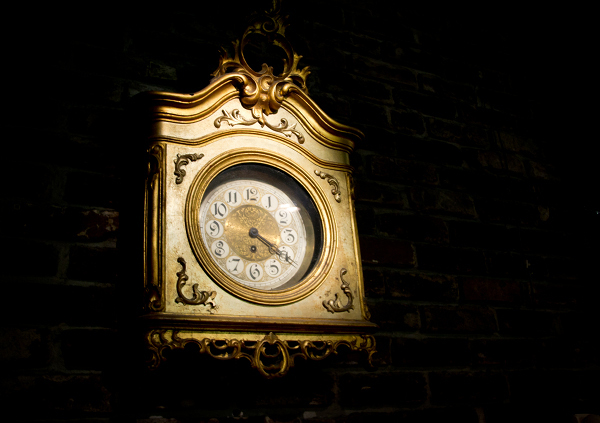
Where is `space to right of wall clock`? This screenshot has width=600, height=423. space to right of wall clock is located at coordinates (362, 239).